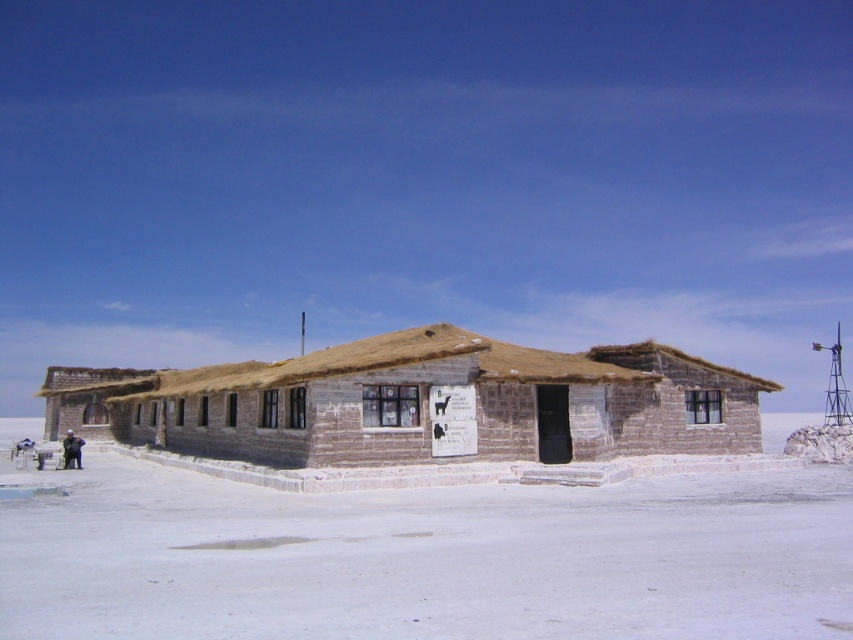
Question: Does white salt flat at center appear under dark blue fabric jacket at lower left?

Choices:
 (A) no
 (B) yes

Answer: (A)

Question: Which point appears farthest from the camera in this image?

Choices:
 (A) (425, 424)
 (B) (78, 456)

Answer: (B)

Question: Considering the relative positions of white salt flat at center and rustic wooden hut at center in the image provided, where is white salt flat at center located with respect to rustic wooden hut at center?

Choices:
 (A) right
 (B) left

Answer: (A)

Question: Which point is closer to the camera taking this photo?

Choices:
 (A) (502, 566)
 (B) (310, 461)

Answer: (A)

Question: Estimate the real-world distances between objects in this image. Which object is farther from the white salt flat at center?

Choices:
 (A) dark blue fabric jacket at lower left
 (B) rustic wooden hut at center

Answer: (A)

Question: Is white salt flat at center to the left of dark blue fabric jacket at lower left from the viewer's perspective?

Choices:
 (A) no
 (B) yes

Answer: (A)